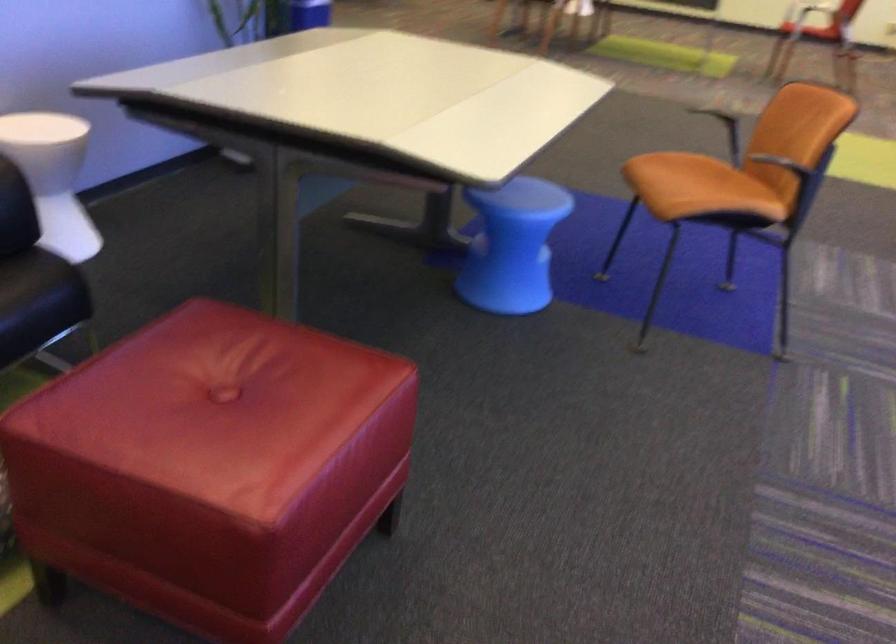
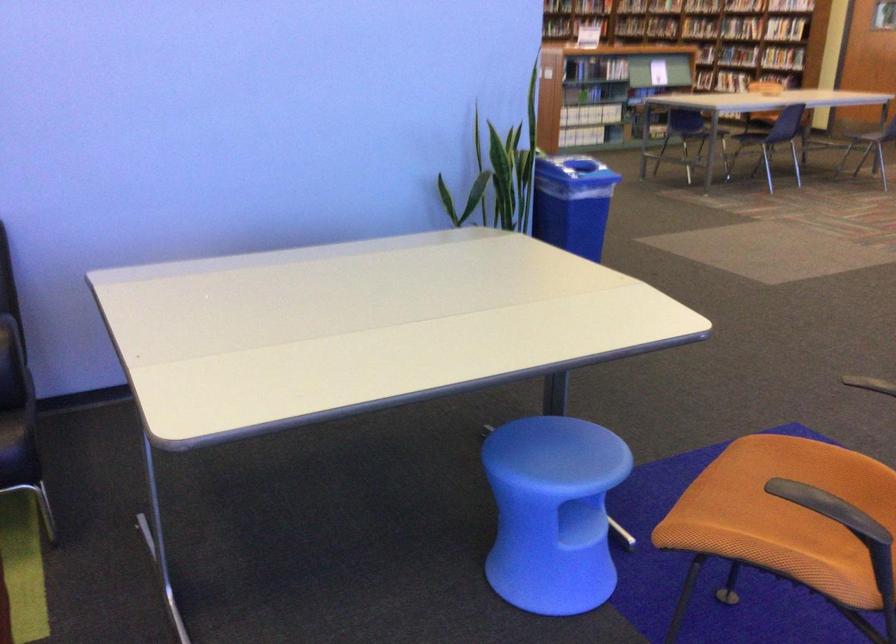
Locate, in the second image, the point that corresponds to point (701, 185) in the first image.

(785, 503)